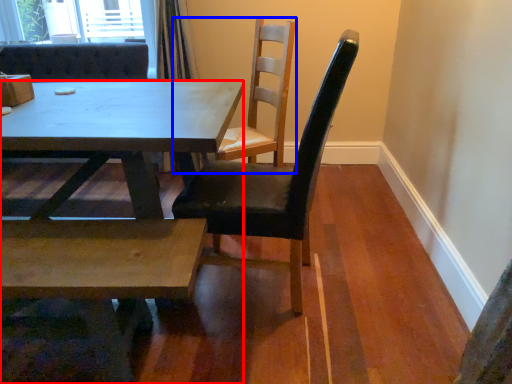
Question: Among these objects, which one is farthest to the camera, kitchen & dining room table (highlighted by a red box) or chair (highlighted by a blue box)?

Choices:
 (A) kitchen & dining room table
 (B) chair

Answer: (B)